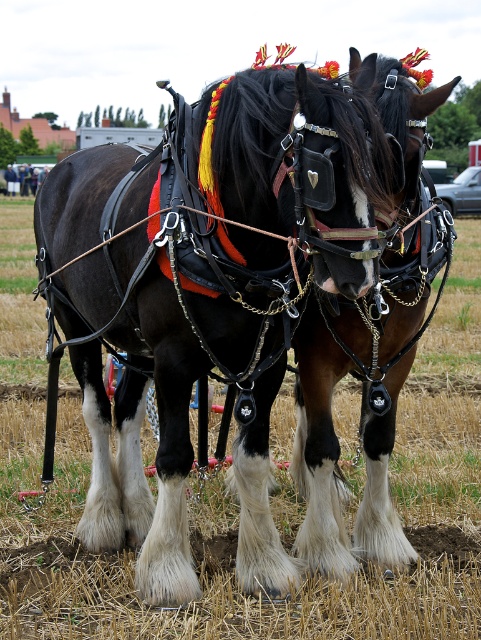
Question: Can you confirm if black leather horse at center is positioned to the left of brushed metal water at bottle left?

Choices:
 (A) yes
 (B) no

Answer: (B)

Question: Is black leather horse at center wider than brushed metal water at bottle left?

Choices:
 (A) yes
 (B) no

Answer: (B)

Question: Which point appears farthest from the camera in this image?

Choices:
 (A) (12, 173)
 (B) (236, 108)

Answer: (A)

Question: Can you confirm if black leather horse at center is thinner than brushed metal water at bottle left?

Choices:
 (A) yes
 (B) no

Answer: (A)

Question: Which of the following is the farthest from the observer?

Choices:
 (A) (33, 192)
 (B) (327, 236)

Answer: (A)